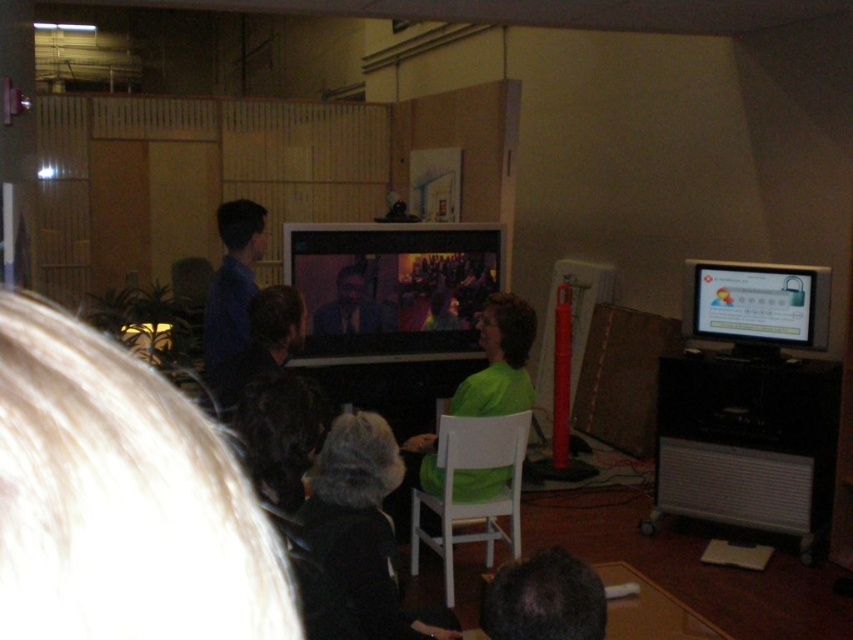
Question: Can you confirm if white plastic chair at center is thinner than green matte shirt at center?

Choices:
 (A) no
 (B) yes

Answer: (B)

Question: Based on their relative distances, which object is farther from the white plastic chair at center?

Choices:
 (A) green matte shirt at center
 (B) dark brown hair at lower center
 (C) dark gray knit hat at lower center

Answer: (B)

Question: Among these objects, which one is nearest to the camera?

Choices:
 (A) dark brown hair at center
 (B) white plastic chair at center
 (C) green matte shirt at center

Answer: (A)

Question: Observing the image, what is the correct spatial positioning of dark brown hair at center in reference to matte black screen at center?

Choices:
 (A) above
 (B) below

Answer: (B)

Question: Does dark brown hair at center appear over green matte shirt at center?

Choices:
 (A) yes
 (B) no

Answer: (A)

Question: Based on their relative distances, which object is farther from the dark brown hair at lower center?

Choices:
 (A) matte black screen at center
 (B) dark gray knit hat at lower center
 (C) dark brown hair at center

Answer: (A)